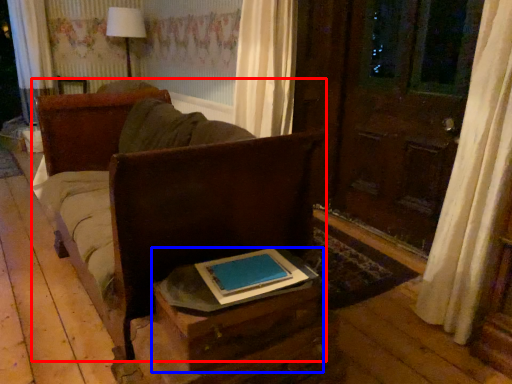
Question: Which point is further to the camera, furniture (highlighted by a red box) or table (highlighted by a blue box)?

Choices:
 (A) furniture
 (B) table

Answer: (A)